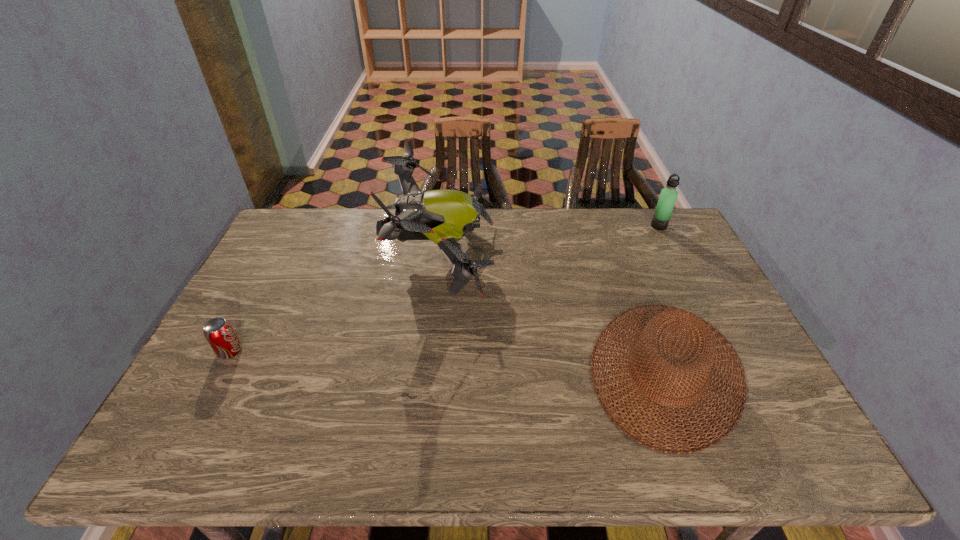
Locate an element on the screen. vacant space that's between the leftmost object and the third tallest object is located at coordinates 448,361.

Find the location of `free spot between the thermos bottle and the third object from right to left`. free spot between the thermos bottle and the third object from right to left is located at coordinates (550, 241).

Find the location of `empty space between the third tallest object and the third object from right to left`. empty space between the third tallest object and the third object from right to left is located at coordinates (554, 313).

Identify the location of free spot between the third tallest object and the second tallest object. The height and width of the screenshot is (540, 960). (662, 298).

The width and height of the screenshot is (960, 540). What are the coordinates of `object that can be found as the second closest to the sunhat` in the screenshot? It's located at (668, 195).

Find the location of `object that is the third nearest to the tallest object`. object that is the third nearest to the tallest object is located at coordinates (668, 195).

Where is `blank area in the image that satisfies the following two spatial constraints: 1. on the front side of the second shortest object; 2. on the right side of the leftmost object`? The width and height of the screenshot is (960, 540). blank area in the image that satisfies the following two spatial constraints: 1. on the front side of the second shortest object; 2. on the right side of the leftmost object is located at coordinates (220, 370).

Locate an element on the screen. The width and height of the screenshot is (960, 540). free space that satisfies the following two spatial constraints: 1. on the back side of the thermos bottle; 2. on the right side of the sunhat is located at coordinates (612, 226).

You are a GUI agent. You are given a task and a screenshot of the screen. Output one action in this format:
    pyautogui.click(x=<x>, y=<y>)
    Task: Click on the blank area in the image that satisfies the following two spatial constraints: 1. on the back side of the sunhat; 2. on the front-facing side of the tallest object
    The width and height of the screenshot is (960, 540).
    Given the screenshot: What is the action you would take?
    (623, 256)

Where is `free space that satisfies the following two spatial constraints: 1. on the front-facing side of the third object from right to left; 2. on the left side of the sunhat`? free space that satisfies the following two spatial constraints: 1. on the front-facing side of the third object from right to left; 2. on the left side of the sunhat is located at coordinates (430, 370).